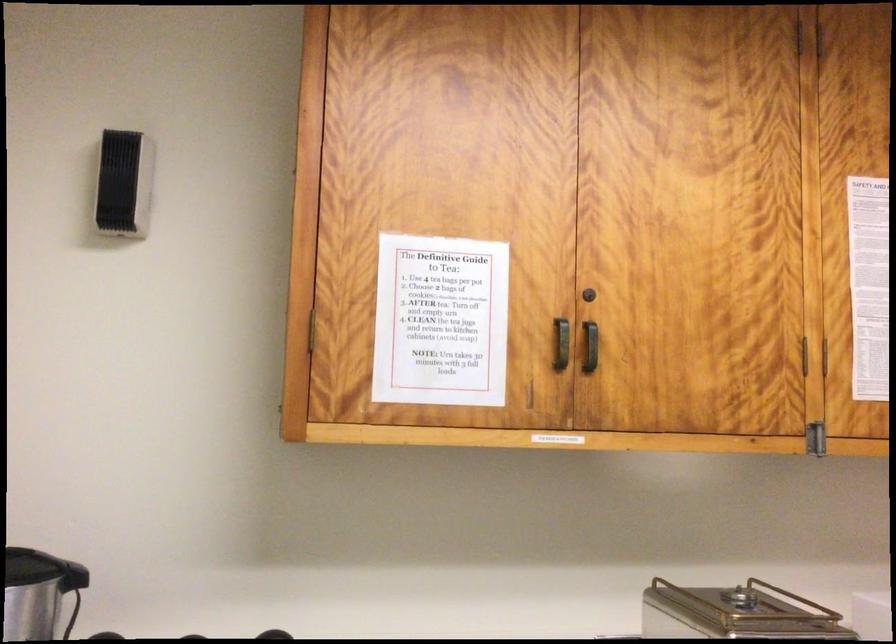
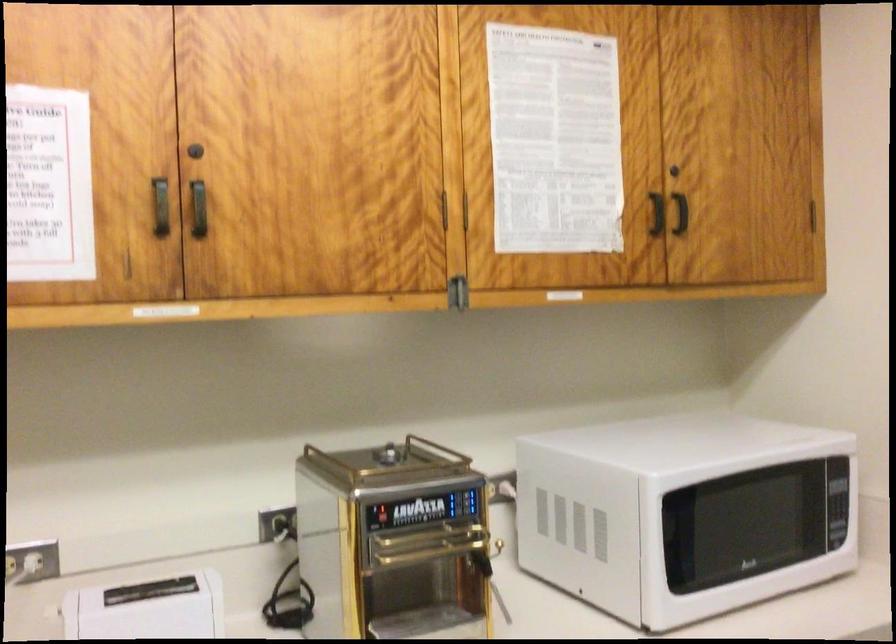
Question: The images are taken continuously from a first-person perspective. In which direction are you moving?

Choices:
 (A) Left
 (B) Right
 (C) Forward
 (D) Backward

Answer: (B)